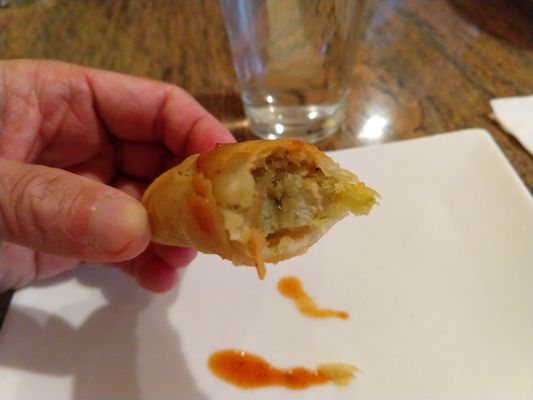
Where is `table`? table is located at coordinates (405, 116).